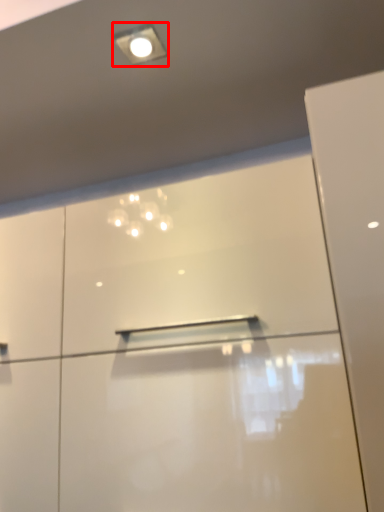
Question: From the image's perspective, what is the correct spatial relationship of droplight (annotated by the red box) in relation to dresser?

Choices:
 (A) below
 (B) above

Answer: (B)